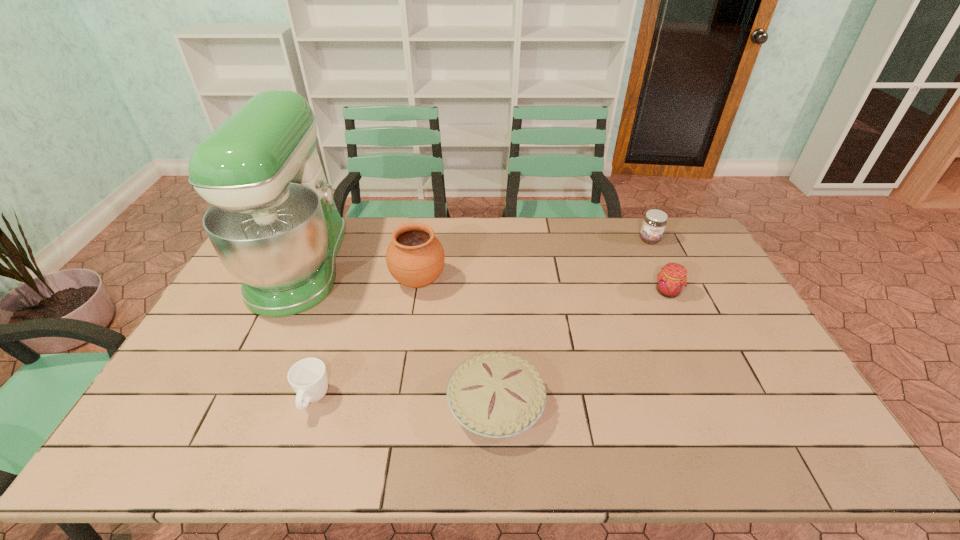
Locate an element on the screen. This screenshot has height=540, width=960. mixer is located at coordinates (273, 222).

You are a GUI agent. You are given a task and a screenshot of the screen. Output one action in this format:
    pyautogui.click(x=<x>, y=<y>)
    Task: Click on the fifth shortest object
    The height and width of the screenshot is (540, 960).
    Given the screenshot: What is the action you would take?
    (x=415, y=257)

Locate an element on the screen. The width and height of the screenshot is (960, 540). pottery is located at coordinates (415, 257).

Locate an element on the screen. Image resolution: width=960 pixels, height=540 pixels. the farther jam is located at coordinates (654, 223).

The height and width of the screenshot is (540, 960). Find the location of `the shorter jam`. the shorter jam is located at coordinates (671, 280).

This screenshot has height=540, width=960. Find the location of `cup`. cup is located at coordinates (308, 377).

The image size is (960, 540). Identify the location of pie. (496, 395).

Locate an element on the screen. free space located on the controls of the mixer is located at coordinates [x=361, y=266].

At what (x,y) coordinates should I click in order to perform the action: click on free spot located on the back of the pottery. Please return your answer as a coordinate pair (x, y). Looking at the image, I should click on (422, 253).

In order to click on free location located on the front label of the farther jam in this screenshot , I will do [x=682, y=306].